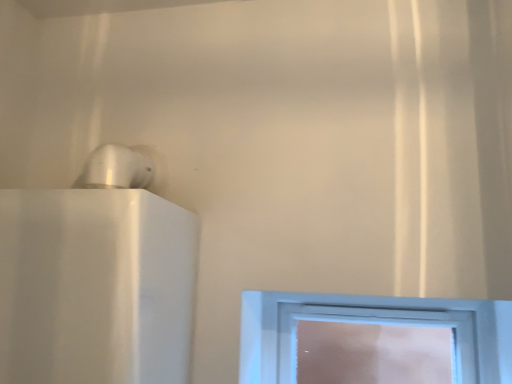
This screenshot has height=384, width=512. Describe the element at coordinates (373, 323) in the screenshot. I see `clear glass window at center` at that location.

Find the location of `clear glass window at center`. clear glass window at center is located at coordinates (373, 323).

Measure the distance between white glossy speaker at upper left and camera.

The depth of white glossy speaker at upper left is 26.80 inches.

The width and height of the screenshot is (512, 384). Describe the element at coordinates (95, 287) in the screenshot. I see `white glossy speaker at upper left` at that location.

I want to click on white glossy speaker at upper left, so click(x=95, y=287).

Measure the distance between point (49,257) and camera.

Point (49,257) and camera are 28.90 inches apart from each other.

At what (x,y) coordinates should I click in order to perform the action: click on clear glass window at center. Please return your answer as a coordinate pair (x, y). Image resolution: width=512 pixels, height=384 pixels. Looking at the image, I should click on (373, 323).

Would you say clear glass window at center is to the left or to the right of white glossy speaker at upper left in the picture?

Based on their positions, clear glass window at center is located to the right of white glossy speaker at upper left.

Is clear glass window at center closer to camera compared to white glossy speaker at upper left?

No, clear glass window at center is further to the viewer.

Considering the positions of point (381, 304) and point (192, 239), is point (381, 304) closer or farther from the camera than point (192, 239)?

Point (381, 304) is farther from the camera than point (192, 239).

From the image's perspective, which one is positioned higher, clear glass window at center or white glossy speaker at upper left?

white glossy speaker at upper left, from the image's perspective.

From a real-world perspective, which is physically below, clear glass window at center or white glossy speaker at upper left?

From a 3D spatial view, clear glass window at center is below.

Which object is wider, clear glass window at center or white glossy speaker at upper left?

white glossy speaker at upper left.

Between clear glass window at center and white glossy speaker at upper left, which one has more height?

Standing taller between the two is white glossy speaker at upper left.

Who is smaller, clear glass window at center or white glossy speaker at upper left?

clear glass window at center is smaller.

Is clear glass window at center not inside white glossy speaker at upper left?

Indeed, clear glass window at center is completely outside white glossy speaker at upper left.

Would you consider clear glass window at center to be distant from white glossy speaker at upper left?

No, clear glass window at center is in close proximity to white glossy speaker at upper left.

Is white glossy speaker at upper left at the back of clear glass window at center?

That's not correct — clear glass window at center is not looking away from white glossy speaker at upper left.

What's the angular difference between clear glass window at center and white glossy speaker at upper left's facing directions?

The facing directions of clear glass window at center and white glossy speaker at upper left are 0.584 degrees apart.

How much distance is there between clear glass window at center and white glossy speaker at upper left?

The distance of clear glass window at center from white glossy speaker at upper left is 16.33 inches.

Find the location of a particular element. appliance above the clear glass window at center (from a real-world perspective) is located at coordinates (95, 287).

Does white glossy speaker at upper left appear on the right side of clear glass window at center?

No, white glossy speaker at upper left is not to the right of clear glass window at center.

Is the position of white glossy speaker at upper left more distant than that of clear glass window at center?

No, it is not.

Which is behind, point (170, 253) or point (456, 320)?

The point (456, 320) is farther from the camera.

From the image's perspective, which is below, white glossy speaker at upper left or clear glass window at center?

clear glass window at center appears lower in the image.

From a real-world perspective, relative to clear glass window at center, is white glossy speaker at upper left vertically above or below?

From a real-world perspective, white glossy speaker at upper left is physically above clear glass window at center.

Which of these two, white glossy speaker at upper left or clear glass window at center, is thinner?

With smaller width is clear glass window at center.

In terms of height, does white glossy speaker at upper left look taller or shorter compared to clear glass window at center?

Clearly, white glossy speaker at upper left is taller compared to clear glass window at center.

Who is smaller, white glossy speaker at upper left or clear glass window at center?

clear glass window at center.

Is white glossy speaker at upper left situated inside clear glass window at center or outside?

white glossy speaker at upper left lies outside clear glass window at center.

Are white glossy speaker at upper left and clear glass window at center making contact?

No.

Does white glossy speaker at upper left turn towards clear glass window at center?

No, white glossy speaker at upper left is not facing towards clear glass window at center.

Where is `window below the white glossy speaker at upper left (from a real-world perspective)`? The width and height of the screenshot is (512, 384). window below the white glossy speaker at upper left (from a real-world perspective) is located at coordinates (373, 323).

Where is `window below the white glossy speaker at upper left (from a real-world perspective)`? The image size is (512, 384). window below the white glossy speaker at upper left (from a real-world perspective) is located at coordinates (373, 323).

The height and width of the screenshot is (384, 512). Find the location of `window on the right of the white glossy speaker at upper left`. window on the right of the white glossy speaker at upper left is located at coordinates (373, 323).